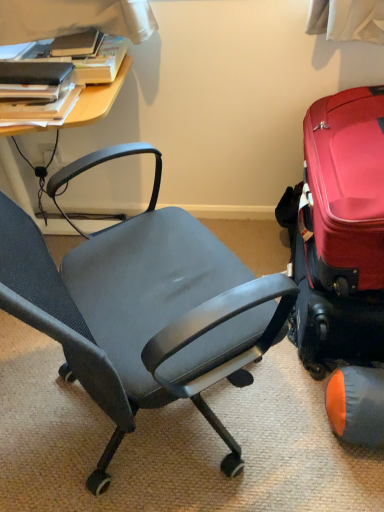
Question: From the image's perspective, is hardcover book at upper left, which is counted as the 1th book, starting from the top, beneath shiny red suitcase at right?

Choices:
 (A) yes
 (B) no

Answer: (B)

Question: Can you confirm if hardcover book at upper left, which is counted as the 1th book, starting from the top, is thinner than shiny red suitcase at right?

Choices:
 (A) no
 (B) yes

Answer: (B)

Question: Is hardcover book at upper left, which is counted as the 1th book, starting from the top, at the left side of shiny red suitcase at right?

Choices:
 (A) yes
 (B) no

Answer: (A)

Question: Can you confirm if hardcover book at upper left, which is counted as the 1th book, starting from the top, is bigger than shiny red suitcase at right?

Choices:
 (A) no
 (B) yes

Answer: (A)

Question: Would you say hardcover book at upper left, which is counted as the 1th book, starting from the top, contains shiny red suitcase at right?

Choices:
 (A) yes
 (B) no

Answer: (B)

Question: From their relative heights in the image, would you say shiny red suitcase at right is taller or shorter than orange fabric bean bag chair at lower right?

Choices:
 (A) short
 (B) tall

Answer: (B)

Question: Is shiny red suitcase at right inside the boundaries of orange fabric bean bag chair at lower right, or outside?

Choices:
 (A) outside
 (B) inside

Answer: (A)

Question: From the image's perspective, relative to orange fabric bean bag chair at lower right, is shiny red suitcase at right above or below?

Choices:
 (A) above
 (B) below

Answer: (A)

Question: Considering the positions of shiny red suitcase at right and orange fabric bean bag chair at lower right in the image, is shiny red suitcase at right bigger or smaller than orange fabric bean bag chair at lower right?

Choices:
 (A) small
 (B) big

Answer: (B)

Question: From a real-world perspective, is matte black book at upper left, arranged as the 1th book when ordered from the bottom, positioned above or below hardcover book at upper left, which appears as the second book when ordered from the bottom?

Choices:
 (A) above
 (B) below

Answer: (B)

Question: Is point (9, 69) positioned closer to the camera than point (89, 62)?

Choices:
 (A) closer
 (B) farther

Answer: (A)

Question: Would you say matte black book at upper left, which is the second book in top-to-bottom order, is to the left or to the right of hardcover book at upper left, which appears as the second book when ordered from the bottom, in the picture?

Choices:
 (A) right
 (B) left

Answer: (B)

Question: In terms of size, does matte black book at upper left, arranged as the 1th book when ordered from the bottom, appear bigger or smaller than hardcover book at upper left, which is counted as the 1th book, starting from the top?

Choices:
 (A) big
 (B) small

Answer: (B)

Question: From a real-world perspective, is orange fabric bean bag chair at lower right physically located above or below hardcover book at upper left, which is counted as the 1th book, starting from the top?

Choices:
 (A) above
 (B) below

Answer: (B)

Question: Considering the positions of orange fabric bean bag chair at lower right and hardcover book at upper left, which is counted as the 1th book, starting from the top, in the image, is orange fabric bean bag chair at lower right taller or shorter than hardcover book at upper left, which is counted as the 1th book, starting from the top,?

Choices:
 (A) short
 (B) tall

Answer: (B)